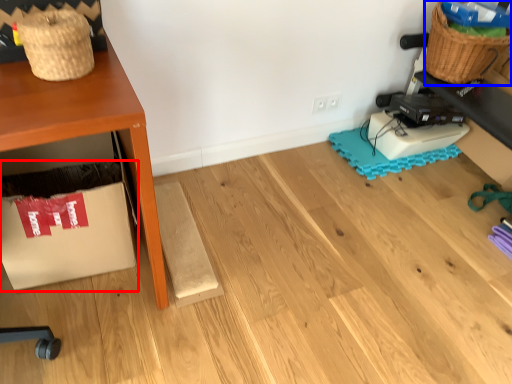
Question: Which object appears farthest to the camera in this image, cardboard box (highlighted by a red box) or basket (highlighted by a blue box)?

Choices:
 (A) cardboard box
 (B) basket

Answer: (B)